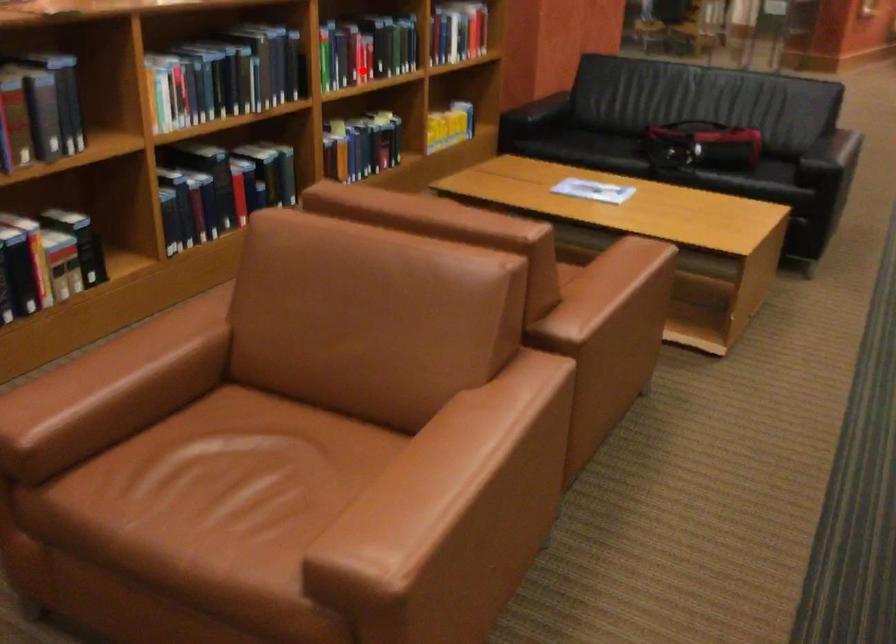
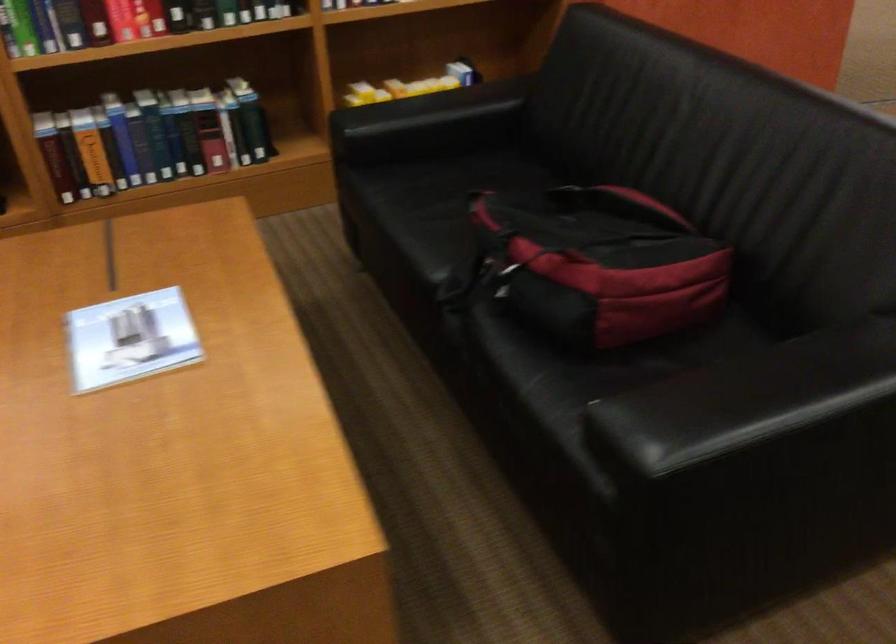
The point at the highlighted location is marked in the first image. Where is the corresponding point in the second image?

(123, 21)